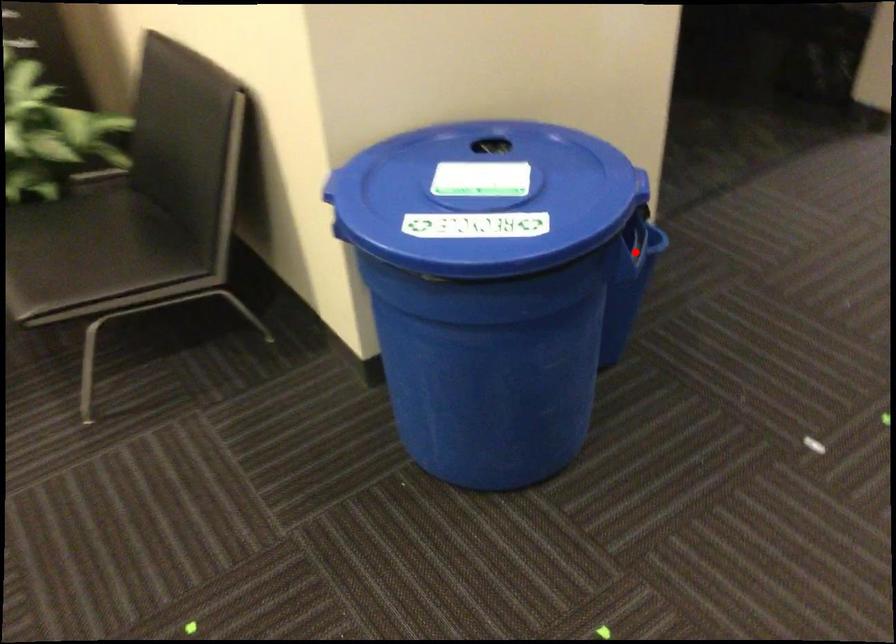
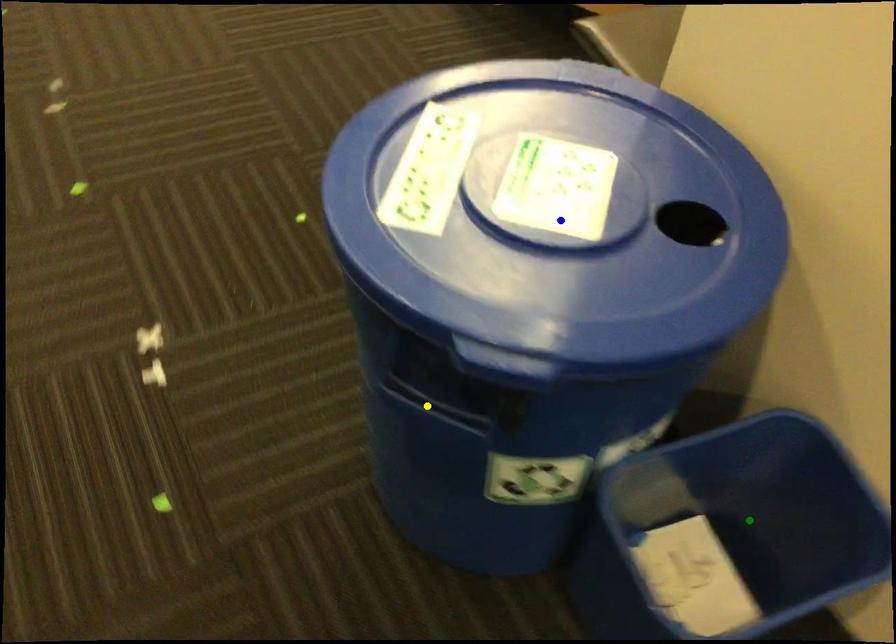
Question: I am providing you with two images of the same scene from different viewpoints. A red point is marked on the first image. You are given multiple points on the second image. Which point in image 2 represents the same 3d spot as the red point in image 1?

Choices:
 (A) yellow point
 (B) green point
 (C) blue point

Answer: (A)